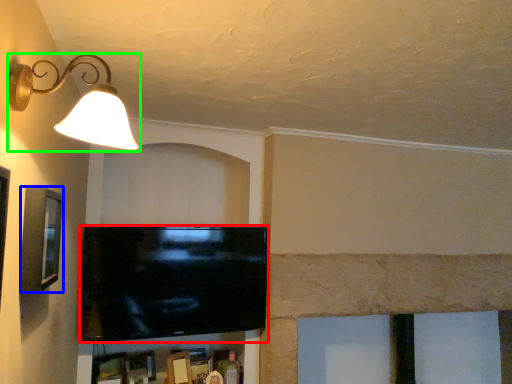
Question: Based on their relative distances, which object is nearer to television (highlighted by a red box)? Choose from picture frame (highlighted by a blue box) and lamp (highlighted by a green box).

Choices:
 (A) picture frame
 (B) lamp

Answer: (A)